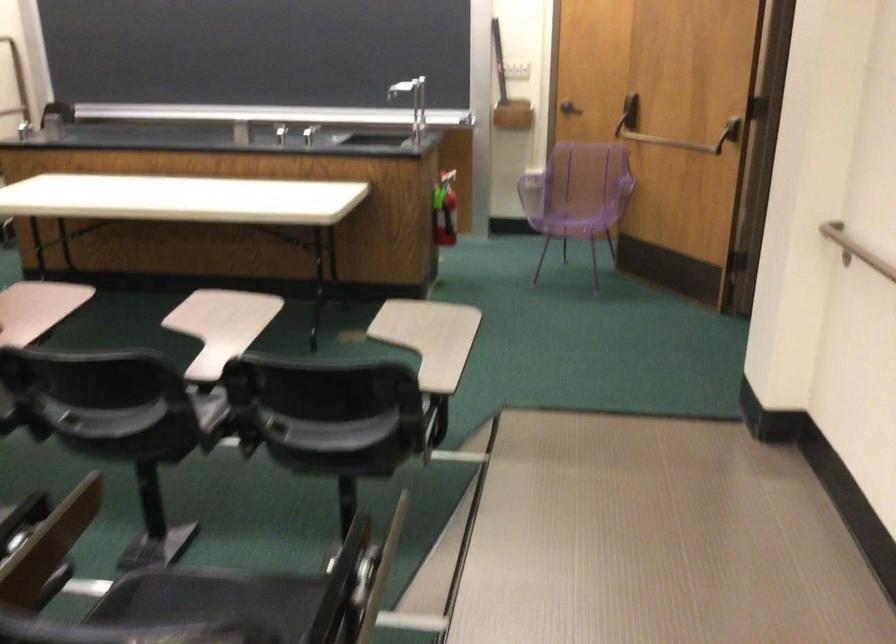
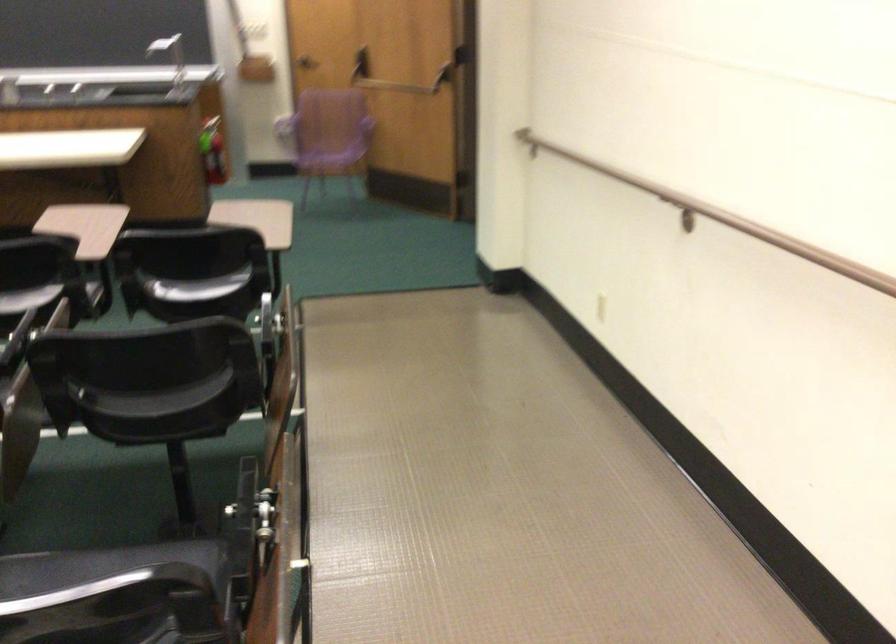
Find the pixel in the second image that matches the point at 438,205 in the first image.

(212, 151)